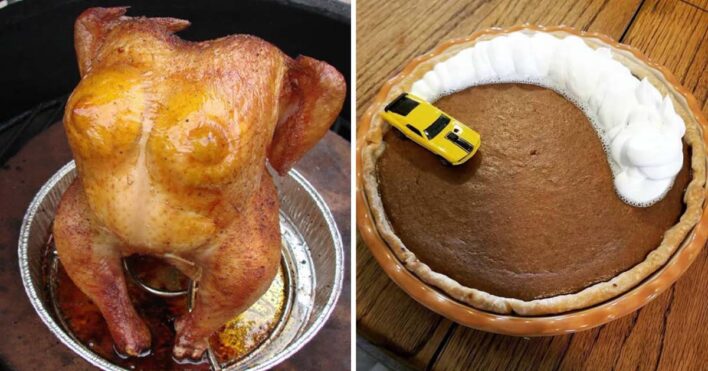
Locate an element on the screen. pie plate is located at coordinates (552, 330).